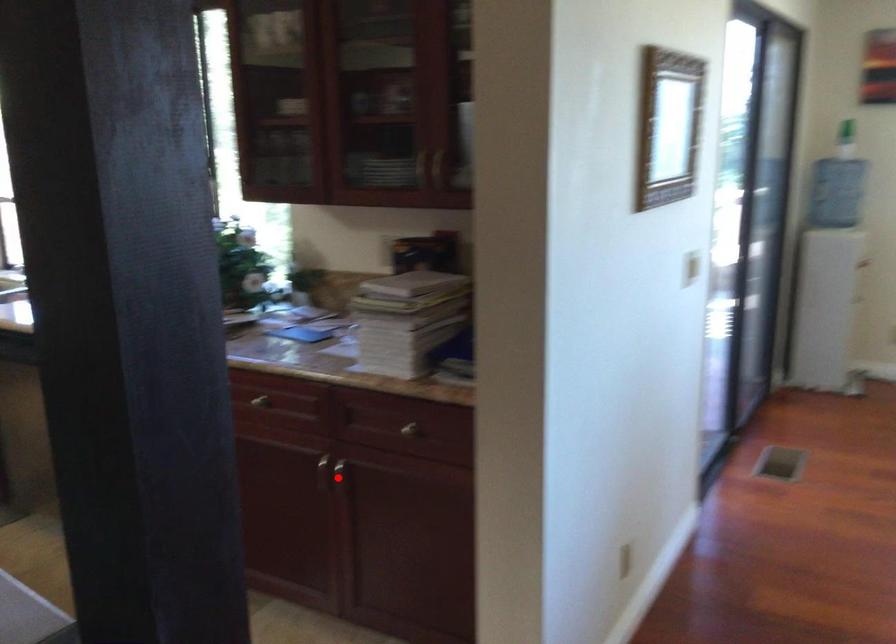
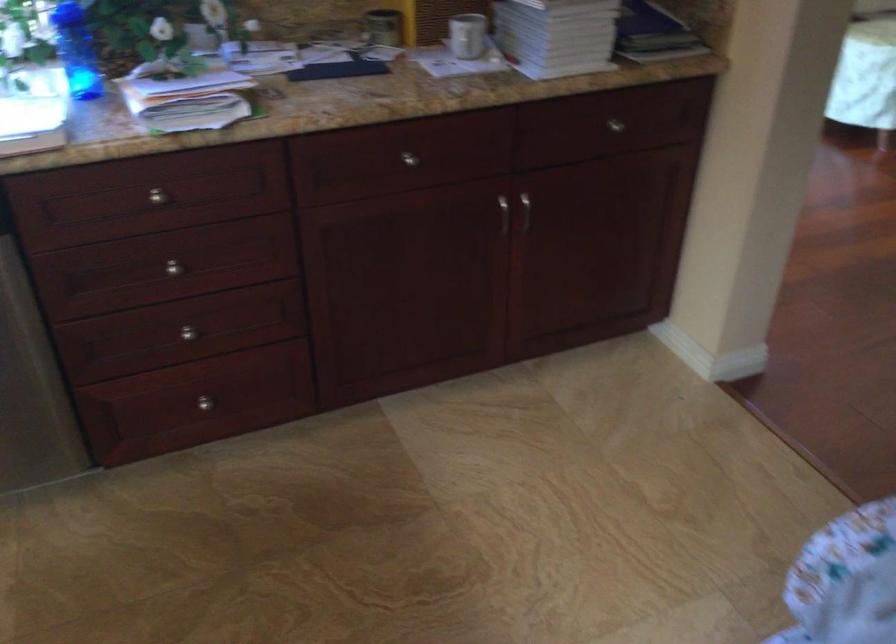
In the second image, find the point that corresponds to the highlighted location in the first image.

(515, 213)